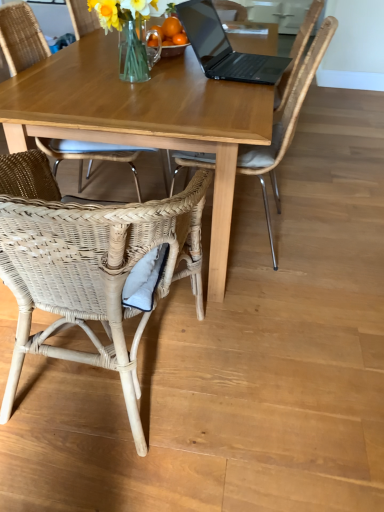
Locate an element on the screen. free location in front of translucent glass vase at upper center is located at coordinates [124, 98].